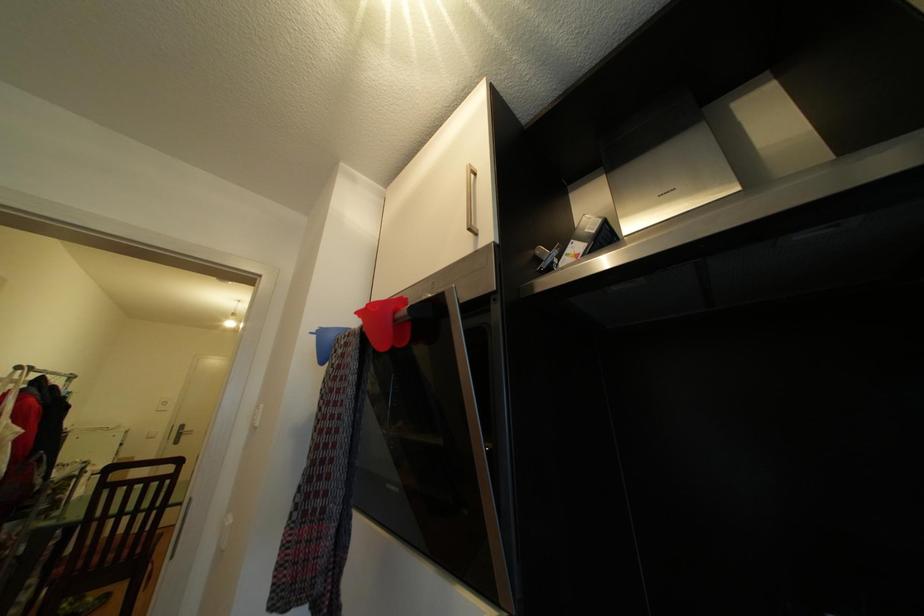
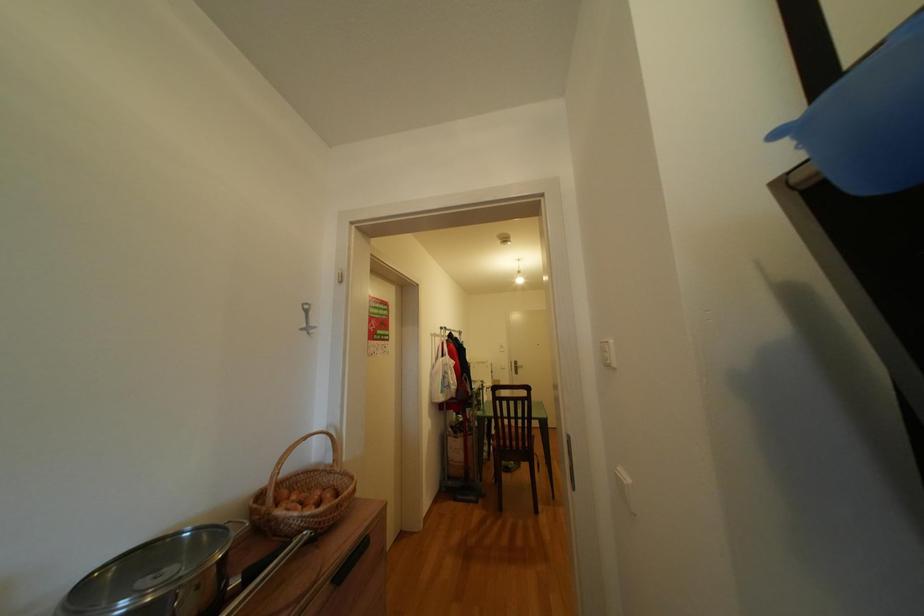
Question: The first image is from the beginning of the video and the second image is from the end. How did the camera likely rotate when shooting the video?

Choices:
 (A) Left
 (B) Right
 (C) Up
 (D) Down

Answer: (A)